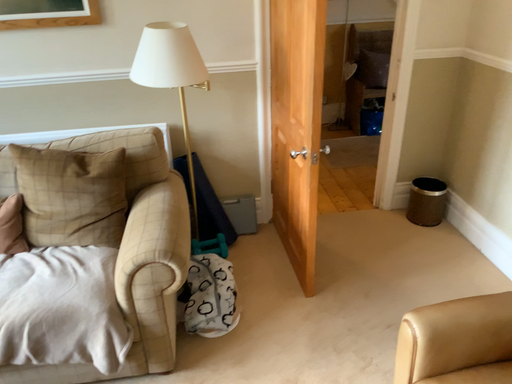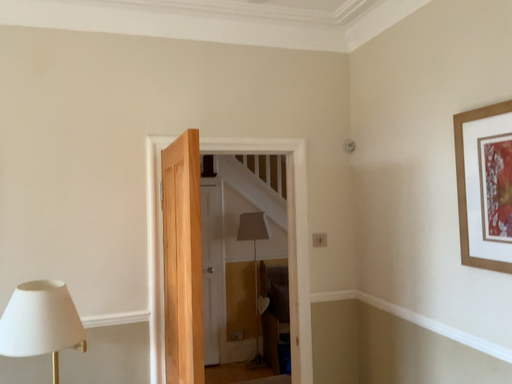
Question: Which way did the camera rotate in the video?

Choices:
 (A) rotated right
 (B) rotated left

Answer: (A)